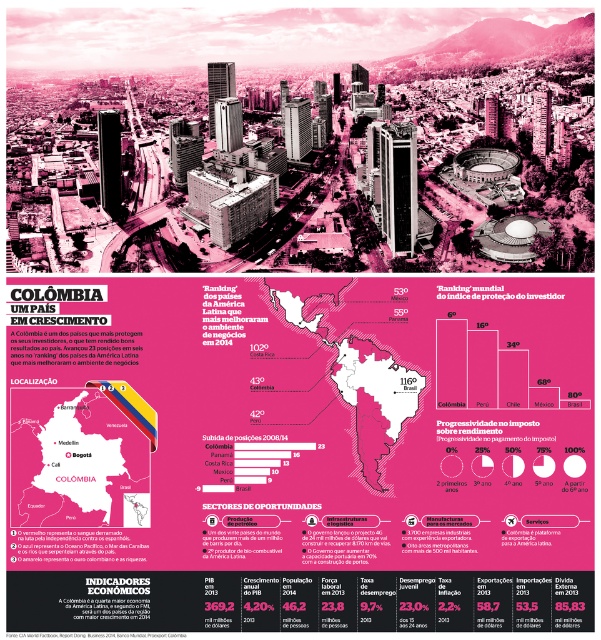
You are looking at an infographic about Colombia. There is a point labeled at coordinates [79,456]. Where is this point located on the infographic?

The point labeled at coordinates [79,456] is located on the matte black map at center.

You are designing a poster and need to place both the matte black map at center and the pink paper map at center. Which map should you choose if you want the one that takes up more vertical space?

The pink paper map at center is taller, so it takes up more vertical space than the matte black map at center.